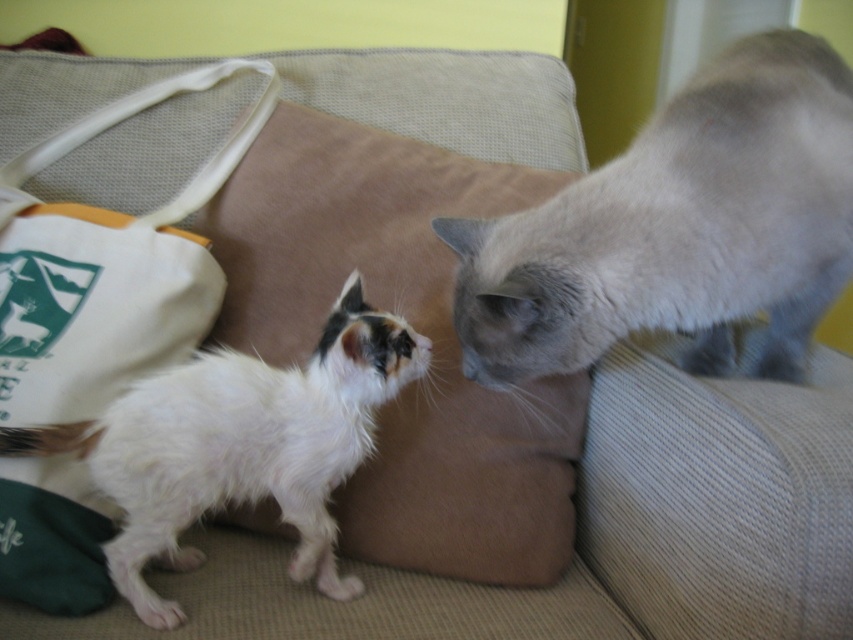
Question: Among these points, which one is farthest from the camera?

Choices:
 (A) (x=41, y=502)
 (B) (x=492, y=520)

Answer: (B)

Question: Which object is closer to the camera taking this photo?

Choices:
 (A) canvas bag at upper left
 (B) gray silky cat at upper right

Answer: (B)

Question: Which object is the closest to the canvas bag at upper left?

Choices:
 (A) white canvas bag at left
 (B) white fluffy cat at left
 (C) beige fabric pillow at center

Answer: (A)

Question: Where is beige fabric pillow at center located in relation to white fluffy cat at left in the image?

Choices:
 (A) right
 (B) left

Answer: (A)

Question: Does gray silky cat at upper right appear over white fluffy cat at left?

Choices:
 (A) yes
 (B) no

Answer: (A)

Question: Is white canvas bag at left wider than white fluffy cat at left?

Choices:
 (A) yes
 (B) no

Answer: (B)